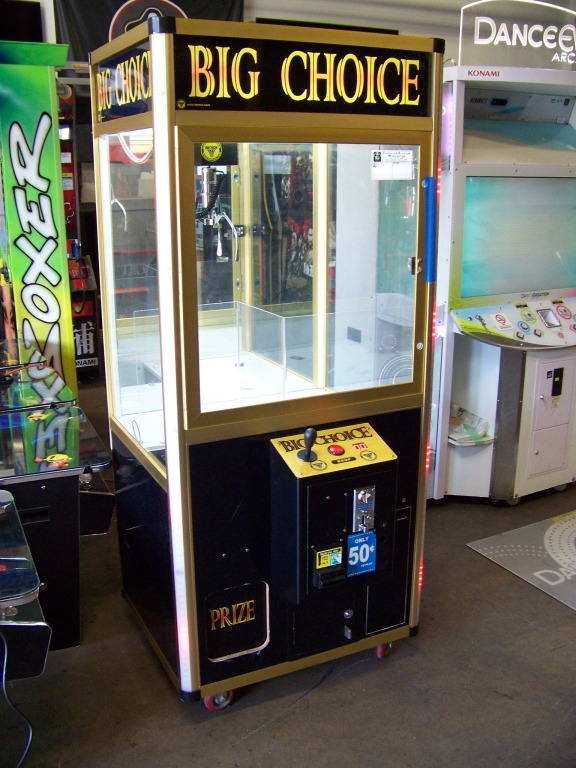
Where is `black wire`? The image size is (576, 768). black wire is located at coordinates (29, 737).